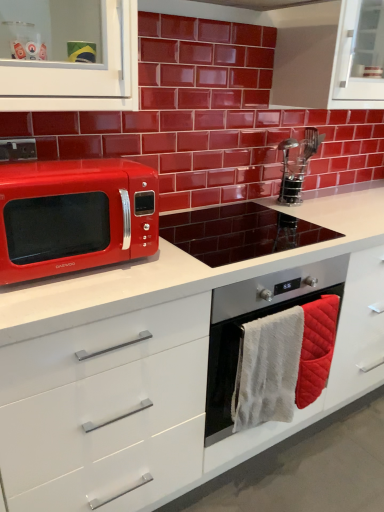
Question: From a real-world perspective, is glossy ceramic microwave at left physically located above or below white glossy countertop at center?

Choices:
 (A) below
 (B) above

Answer: (B)

Question: From the image's perspective, is glossy ceramic microwave at left above or below white glossy countertop at center?

Choices:
 (A) above
 (B) below

Answer: (A)

Question: Which object is the farthest from the white glossy countertop at center?

Choices:
 (A) stainless steel oven at center
 (B) white textured hand towel at center, positioned as the first hand towel in left-to-right order
 (C) stainless steel oven at center
 (D) quilted cotton hand towel at lower right, the first hand towel viewed from the right
 (E) glossy ceramic microwave at left

Answer: (E)

Question: Considering the real-world distances, which object is closest to the stainless steel oven at center?

Choices:
 (A) shiny red microwave at left
 (B) white glossy countertop at center
 (C) white textured hand towel at center, positioned as the first hand towel in left-to-right order
 (D) stainless steel oven at center
 (E) glossy ceramic microwave at left

Answer: (C)